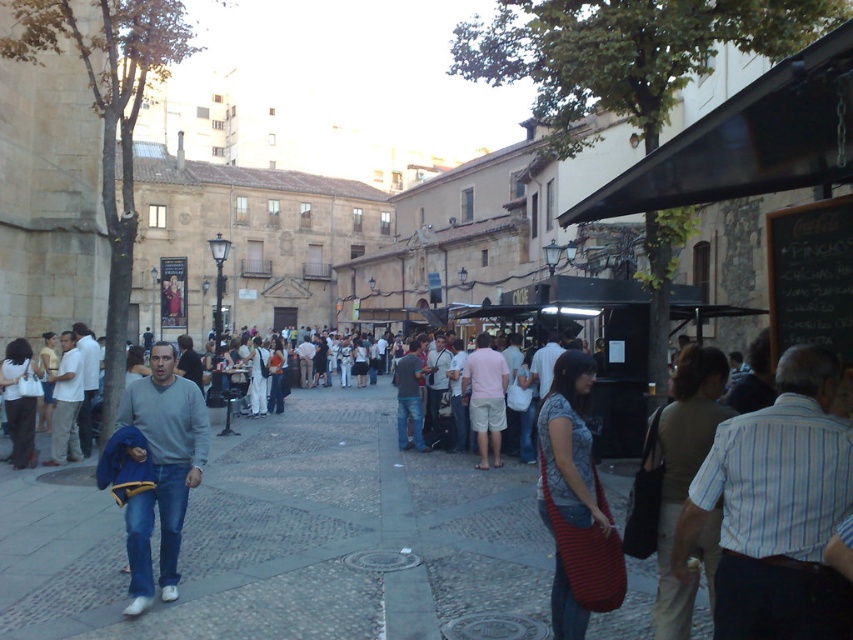
Consider the image. Which is below, blue striped shirt at center or striped fabric bag at lower right?

blue striped shirt at center is lower down.

Which is more to the left, blue striped shirt at center or striped fabric bag at lower right?

striped fabric bag at lower right

This screenshot has height=640, width=853. Identify the location of blue striped shirt at center. (776, 509).

Does point (851, 616) come closer to viewer compared to point (131, 604)?

Yes, it is.

Can you confirm if blue striped shirt at center is positioned above gray sweater at center?

No.

At what (x,y) coordinates should I click in order to perform the action: click on blue striped shirt at center. Please return your answer as a coordinate pair (x, y). Looking at the image, I should click on (776, 509).

The image size is (853, 640). What are the coordinates of `blue striped shirt at center` in the screenshot? It's located at (776, 509).

Is gray sweater at center taller than jeans at center?

Yes.

The width and height of the screenshot is (853, 640). Identify the location of gray sweater at center. (161, 470).